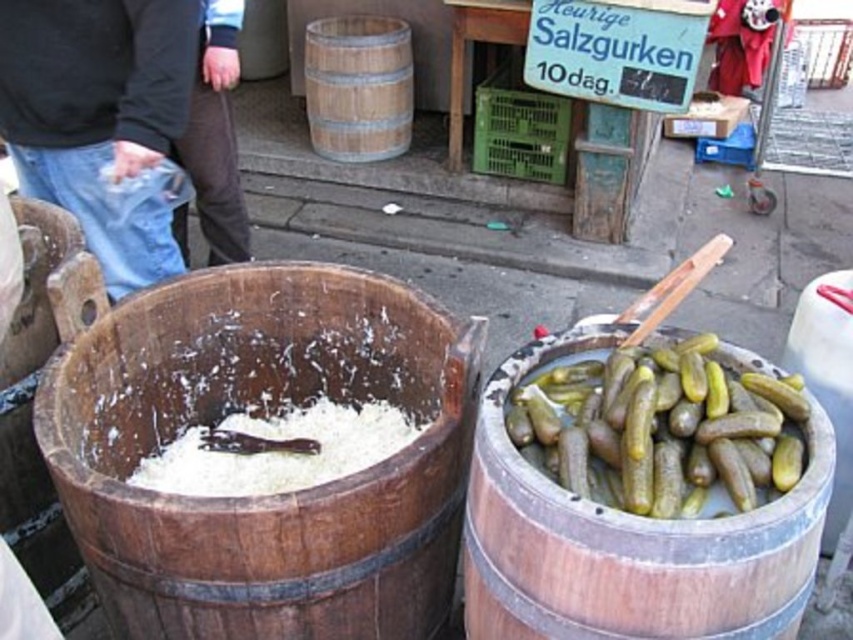
Question: Is green glossy pickles at right to the left of wooden barrel at upper center from the viewer's perspective?

Choices:
 (A) yes
 (B) no

Answer: (B)

Question: Which object is the closest to the wooden barrel at right?

Choices:
 (A) wooden barrel at center
 (B) jeans at left

Answer: (A)

Question: Considering the relative positions of green glossy pickles at right and brown leather pants at center in the image provided, where is green glossy pickles at right located with respect to brown leather pants at center?

Choices:
 (A) left
 (B) right

Answer: (B)

Question: Which point is farther to the camera?

Choices:
 (A) green glossy pickles at right
 (B) wooden barrel at right
 (C) jeans at left
 (D) wooden barrel at upper center

Answer: (D)

Question: Which point is closer to the camera taking this photo?

Choices:
 (A) (515, 419)
 (B) (236, 156)
 (C) (189, 336)

Answer: (A)

Question: Is green glossy pickles at right to the right of brown leather pants at center from the viewer's perspective?

Choices:
 (A) yes
 (B) no

Answer: (A)